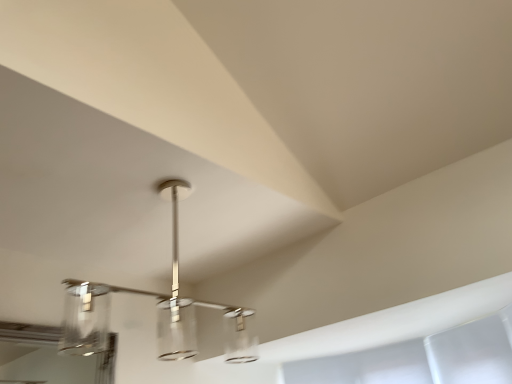
Question: Should I look upward or downward to see polished chrome chandelier at center?

Choices:
 (A) up
 (B) down

Answer: (B)